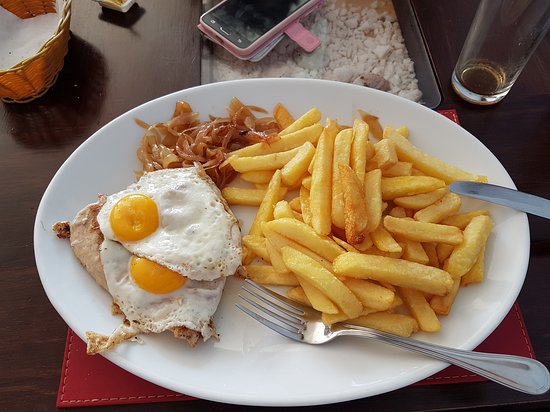
The image size is (550, 412). I want to click on red placemat, so click(78, 379).